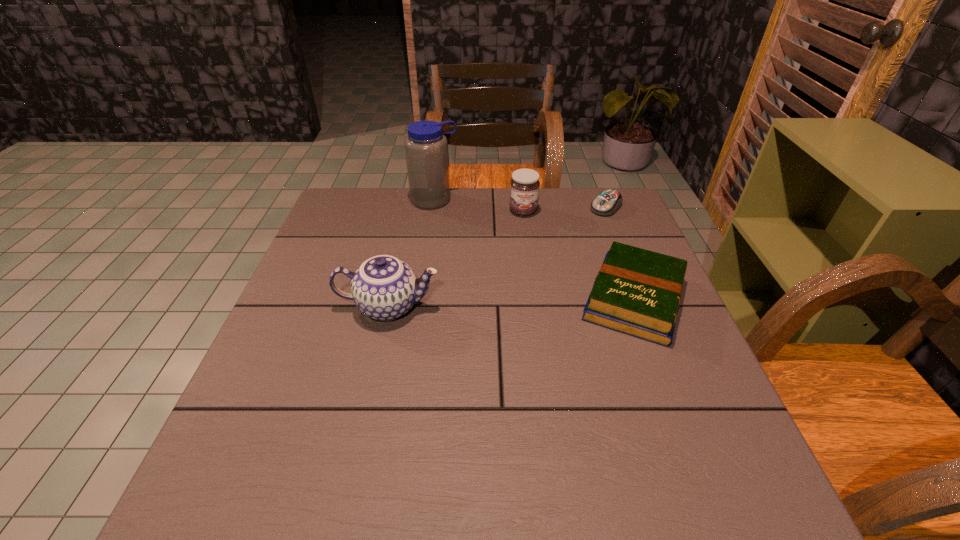
You are a GUI agent. You are given a task and a screenshot of the screen. Output one action in this format:
    pyautogui.click(x=<x>, y=<y>)
    Task: Click on the vacant space situated with a carrying loop on the side of the tallest object
    
    Given the screenshot: What is the action you would take?
    pyautogui.click(x=469, y=282)

Where is `vacant region located 0.340m on the front label of the third object from left to right`? The image size is (960, 540). vacant region located 0.340m on the front label of the third object from left to right is located at coordinates (547, 299).

Locate an element on the screen. This screenshot has width=960, height=540. vacant area located 0.370m on the front label of the third object from left to right is located at coordinates (x=549, y=308).

This screenshot has height=540, width=960. I want to click on blank space located on the front label of the third object from left to right, so click(x=546, y=296).

Locate an element on the screen. This screenshot has height=540, width=960. vacant space located 0.050m on the wheel side of the shortest object is located at coordinates (590, 222).

Image resolution: width=960 pixels, height=540 pixels. I want to click on free location located on the wheel side of the shortest object, so click(x=528, y=279).

Find the location of `free space located on the wheel side of the shortest object`. free space located on the wheel side of the shortest object is located at coordinates (585, 227).

Where is `water bottle located in the far edge section of the desktop`? This screenshot has width=960, height=540. water bottle located in the far edge section of the desktop is located at coordinates (426, 147).

Where is `jam present at the far edge`? jam present at the far edge is located at coordinates (524, 186).

This screenshot has width=960, height=540. Identify the location of computer mouse that is at the far edge. (607, 202).